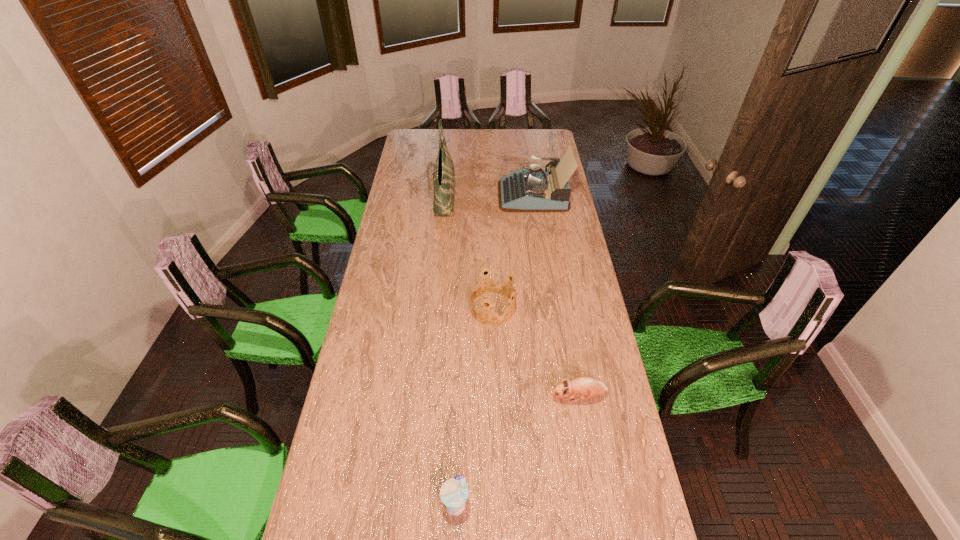
Locate an element on the screen. The width and height of the screenshot is (960, 540). the leftmost object is located at coordinates (443, 173).

Where is `tote bag`? tote bag is located at coordinates (443, 173).

Where is `the fourth shortest object`? the fourth shortest object is located at coordinates point(531,189).

Identify the location of crown. (497, 280).

I want to click on the third tallest object, so click(497, 280).

Locate an element on the screen. This screenshot has height=540, width=960. hamster is located at coordinates (584, 387).

The image size is (960, 540). In order to click on the nearest object in this screenshot , I will do `click(454, 492)`.

At what (x,y) coordinates should I click in order to perform the action: click on vacant point located 0.100m on the front of the tote bag. Please return your answer as a coordinate pair (x, y). Looking at the image, I should click on (441, 234).

Find the location of a particular element. This screenshot has width=960, height=540. free spot located on the typing side of the typewriter is located at coordinates (487, 194).

At what (x,y) coordinates should I click in order to perform the action: click on vacant point located on the typing side of the typewriter. Please return your answer as a coordinate pair (x, y). This screenshot has height=540, width=960. Looking at the image, I should click on (421, 194).